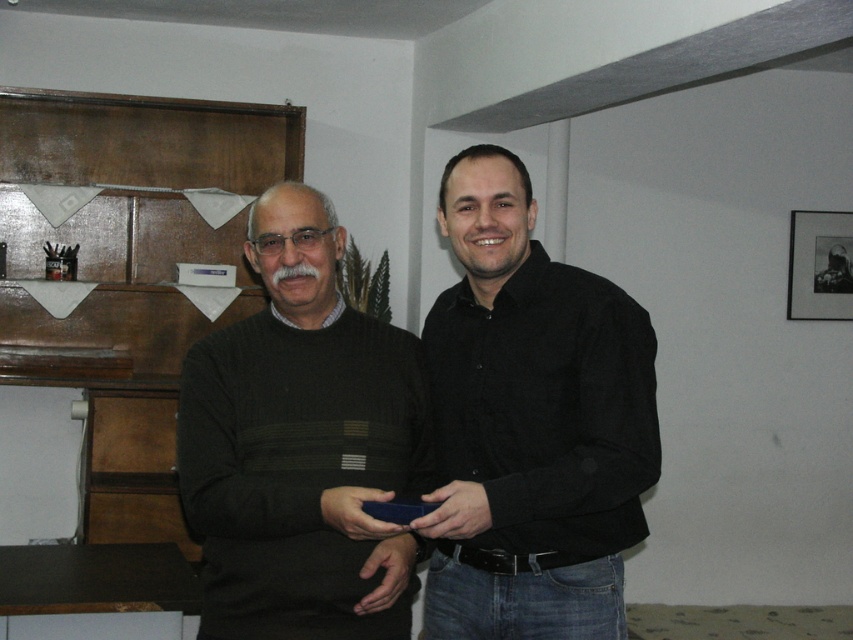
Question: Which point is closer to the camera?

Choices:
 (A) (383, 410)
 (B) (445, 417)

Answer: (A)

Question: Does dark green knitted sweater at left have a larger size compared to black matte picture frame at upper right?

Choices:
 (A) yes
 (B) no

Answer: (A)

Question: Which object appears farthest from the camera in this image?

Choices:
 (A) black matte picture frame at upper right
 (B) dark green knitted sweater at left

Answer: (A)

Question: Can you confirm if black matte shirt at center is bigger than dark green knitted sweater at left?

Choices:
 (A) no
 (B) yes

Answer: (B)

Question: Which of the following is the farthest from the observer?

Choices:
 (A) dark green knitted sweater at left
 (B) black matte picture frame at upper right
 (C) black matte shirt at center

Answer: (B)

Question: Is black matte shirt at center thinner than black matte picture frame at upper right?

Choices:
 (A) yes
 (B) no

Answer: (B)